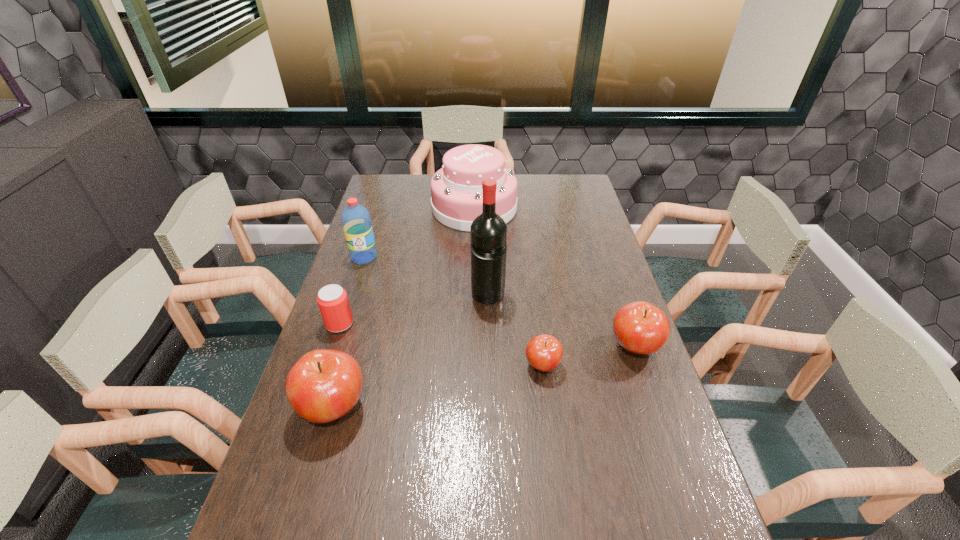
Choose which apple is the nearest neighbor to the second shortest object. Please provide its 2D coordinates. Your answer should be formatted as a tuple, i.e. [(x, y)], where the tuple contains the x and y coordinates of a point satisfying the conditions above.

[(323, 385)]

At what (x,y) coordinates should I click in order to perform the action: click on free space in the image that satisfies the following two spatial constraints: 1. on the front label of the wine bottle; 2. on the left side of the water bottle. Please return your answer as a coordinate pair (x, y). Looking at the image, I should click on (351, 296).

The width and height of the screenshot is (960, 540). In order to click on vacant space that satisfies the following two spatial constraints: 1. on the front label of the rightmost object; 2. on the right side of the water bottle in this screenshot , I will do `click(335, 347)`.

This screenshot has width=960, height=540. In order to click on blank space that satisfies the following two spatial constraints: 1. on the front label of the second farthest object; 2. on the right side of the leftmost apple in this screenshot , I will do `click(317, 407)`.